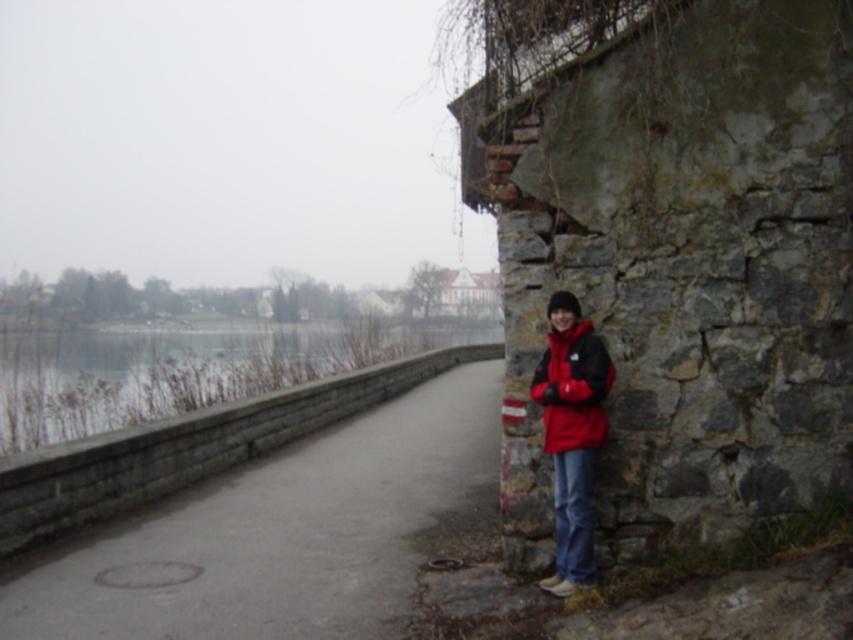
You are standing at the point with coordinates point (39, 384) and want to walk to the point with coordinates point (413, 401). Which direction should you move relative to the current position?

You should move backward to reach point (413, 401) because it is behind point (39, 384).

You are a delivery person trying to reach the smooth concrete wall at left from the concrete sidewalk at center. Which direction should you move to get there?

The concrete sidewalk at center is on the right side of the smooth concrete wall at left, so you should move to the left to reach the smooth concrete wall at left from the concrete sidewalk at center.

From the picture: You are standing at the riverside and see a point marked at coordinates (202, 378). According to the scene description, what does this point indicate?

The point at coordinates (202, 378) indicates a smooth concrete wall at the left side of the frame.